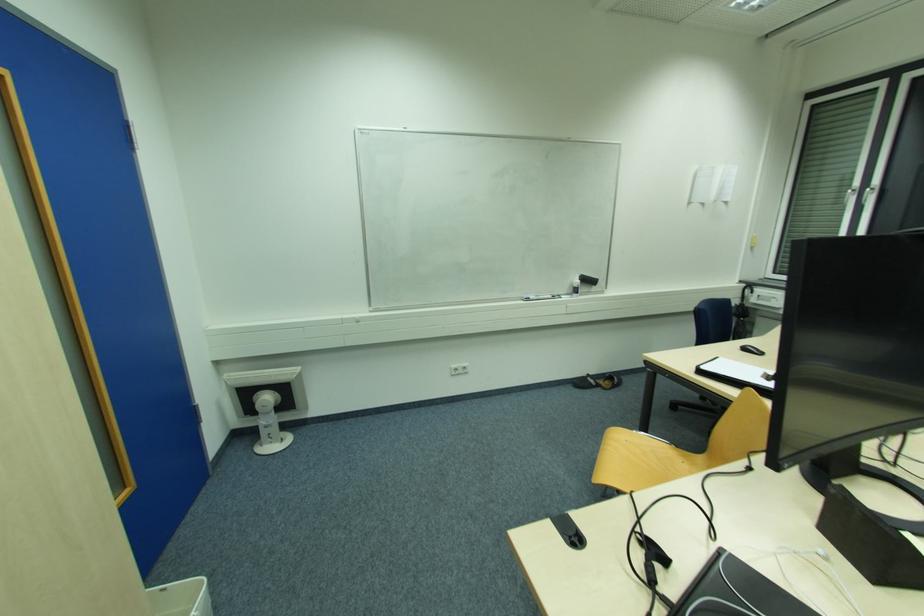
What do you see at coordinates (638, 462) in the screenshot? This screenshot has height=616, width=924. I see `a wooden chair sitting surface` at bounding box center [638, 462].